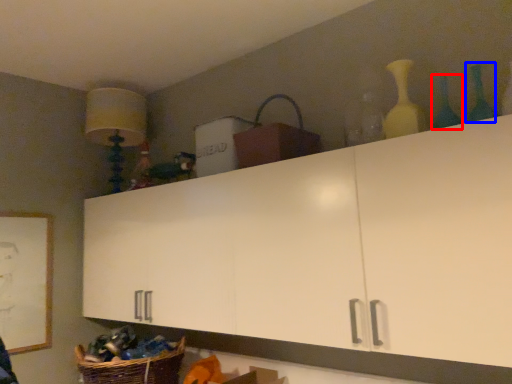
Question: Which object is further to the camera taking this photo, bottle (highlighted by a red box) or bottle (highlighted by a blue box)?

Choices:
 (A) bottle
 (B) bottle

Answer: (A)